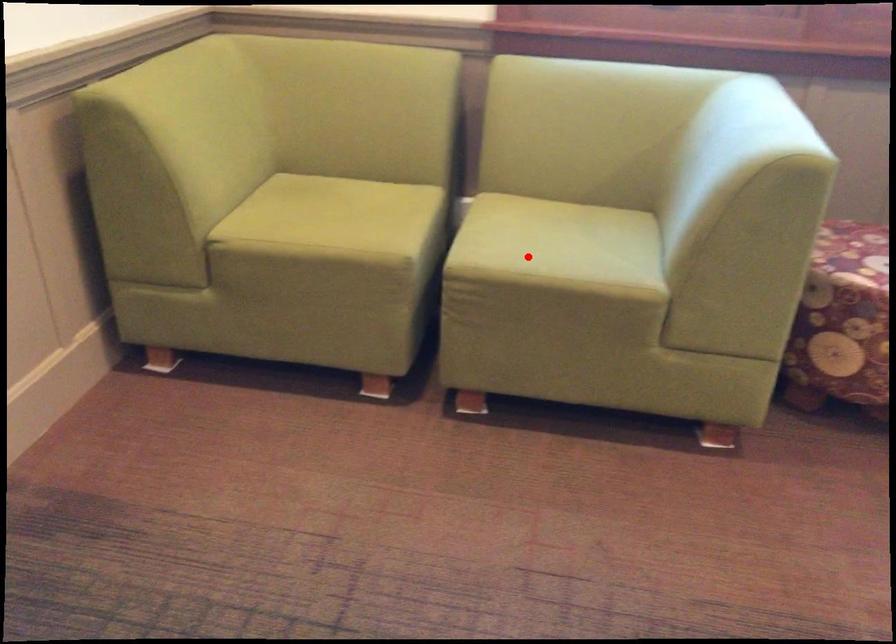
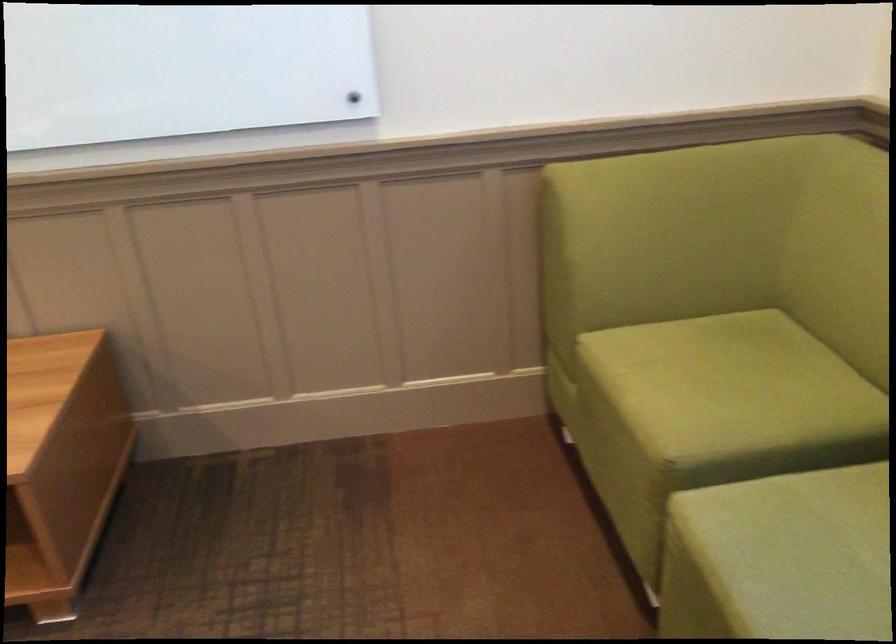
Where in the second image is the point corresponding to the highlighted location from the first image?

(780, 558)